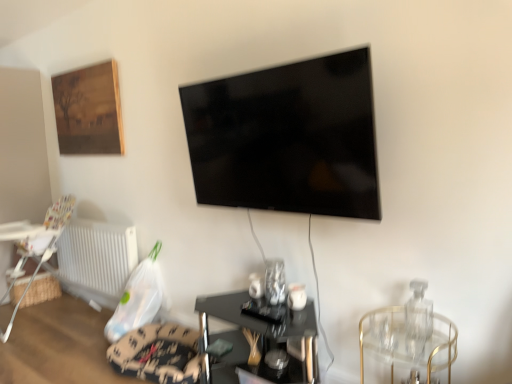
Question: From a real-world perspective, is woven wood table at left, marked as the 2th table in a front-to-back arrangement, physically above black glossy tv at upper center?

Choices:
 (A) no
 (B) yes

Answer: (A)

Question: Considering the relative sizes of woven wood table at left, which appears as the 2th table when viewed from the right, and black glossy tv at upper center in the image provided, is woven wood table at left, which appears as the 2th table when viewed from the right, wider than black glossy tv at upper center?

Choices:
 (A) yes
 (B) no

Answer: (A)

Question: Can you confirm if woven wood table at left, which appears as the 2th table when viewed from the right, is bigger than black glossy tv at upper center?

Choices:
 (A) yes
 (B) no

Answer: (B)

Question: Does woven wood table at left, the 1th table in the back-to-front sequence, have a smaller size compared to black glossy tv at upper center?

Choices:
 (A) no
 (B) yes

Answer: (B)

Question: Is woven wood table at left, the 1th table in the back-to-front sequence, turned away from black glossy tv at upper center?

Choices:
 (A) no
 (B) yes

Answer: (A)

Question: Is woven wood table at left, acting as the 1th table starting from the left, oriented towards black glossy tv at upper center?

Choices:
 (A) yes
 (B) no

Answer: (B)

Question: From a real-world perspective, is clear glass table at right positioned over black glass table at center, the 1th table viewed from the front, based on gravity?

Choices:
 (A) yes
 (B) no

Answer: (A)

Question: Is the surface of clear glass table at right in direct contact with black glass table at center, arranged as the 1th table when viewed from the right?

Choices:
 (A) no
 (B) yes

Answer: (A)

Question: Does clear glass table at right come behind black glass table at center, the 1th table viewed from the front?

Choices:
 (A) yes
 (B) no

Answer: (B)

Question: Does clear glass table at right have a greater height compared to black glass table at center, the second table in the left-to-right sequence?

Choices:
 (A) yes
 (B) no

Answer: (B)

Question: From a real-world perspective, does clear glass table at right sit lower than black glass table at center, which is the 2th table from back to front?

Choices:
 (A) yes
 (B) no

Answer: (B)

Question: From the image's perspective, would you say clear glass table at right is shown under black glass table at center, arranged as the 1th table when viewed from the right?

Choices:
 (A) yes
 (B) no

Answer: (B)

Question: From a real-world perspective, is black glass table at center, the 1th table viewed from the front, under wooden framed painting at upper left?

Choices:
 (A) yes
 (B) no

Answer: (A)